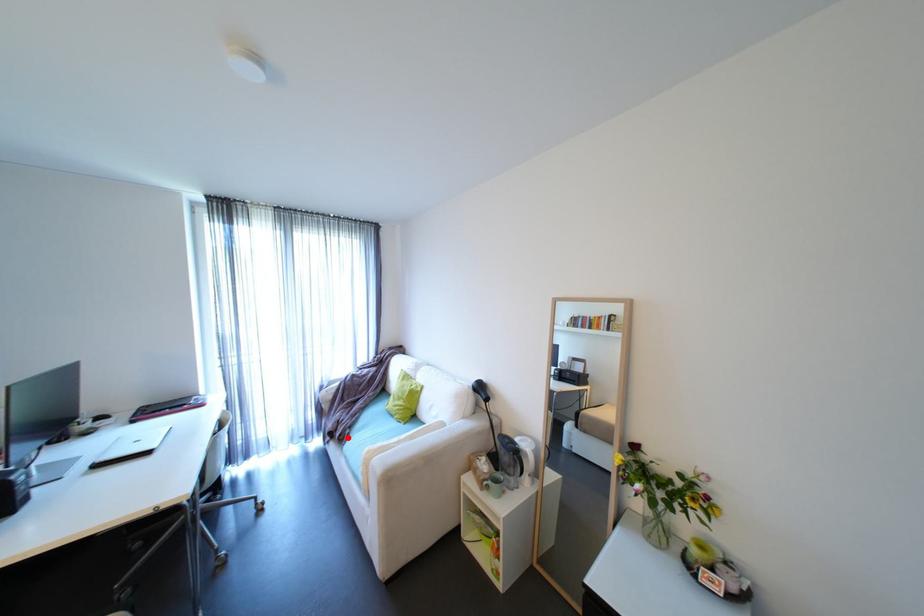
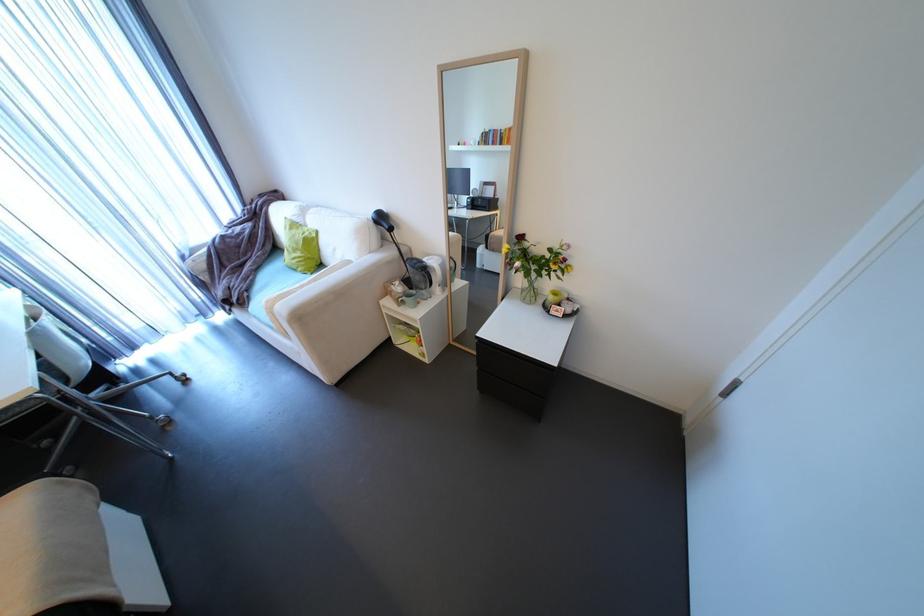
Where in the second image is the point corresponding to the highlighted location from the first image?

(248, 302)